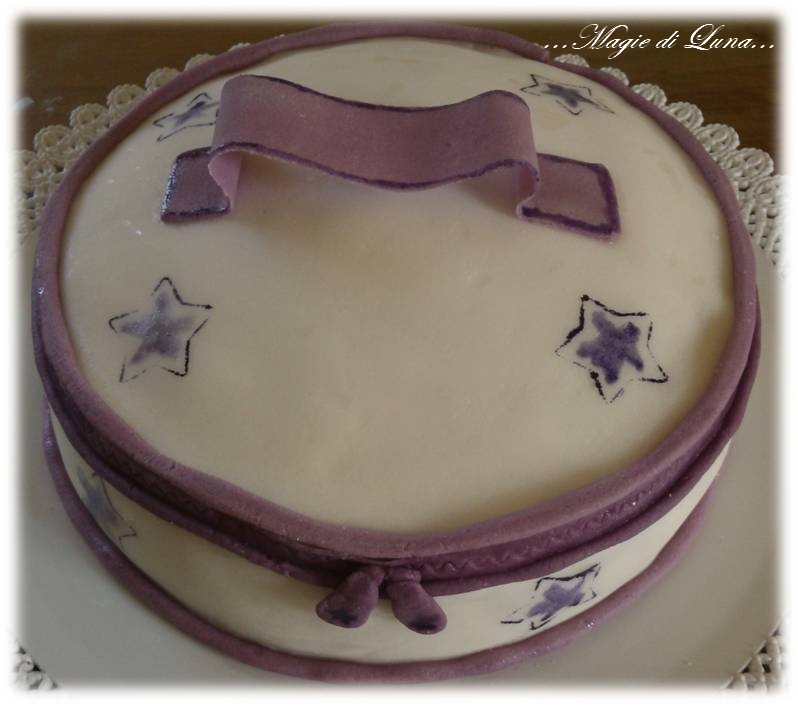
Image resolution: width=798 pixels, height=706 pixels. What are the coordinates of `white doily` in the screenshot? It's located at (62, 149).